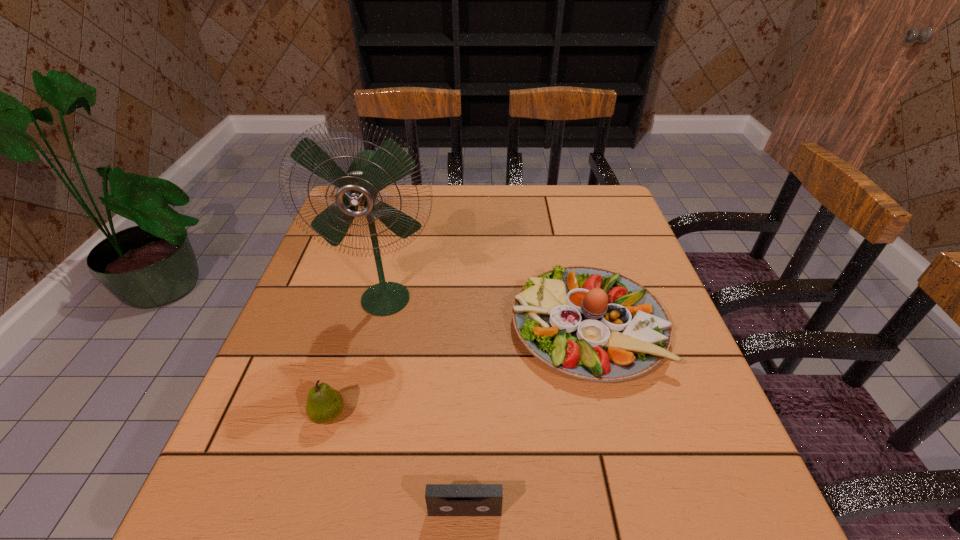
I want to click on fan, so click(x=370, y=172).

I want to click on salad plate, so click(593, 324).

Image resolution: width=960 pixels, height=540 pixels. Identify the location of the second tallest object. (593, 324).

Where is `the third farthest object`? The height and width of the screenshot is (540, 960). the third farthest object is located at coordinates (324, 405).

Find the location of a particular element. The width and height of the screenshot is (960, 540). the third tallest object is located at coordinates (324, 405).

Image resolution: width=960 pixels, height=540 pixels. What are the coordinates of `the second object from right to left` in the screenshot? It's located at (441, 499).

Locate an element on the screen. The width and height of the screenshot is (960, 540). the shortest object is located at coordinates (441, 499).

Identify the location of free space located on the front-facing side of the tallest object. click(373, 353).

This screenshot has width=960, height=540. Identify the location of blank area located 0.210m on the front of the third shortest object. (633, 505).

At what (x,y) coordinates should I click in order to perform the action: click on free location located on the back of the second nearest object. Please return your answer as a coordinate pair (x, y). Looking at the image, I should click on (344, 362).